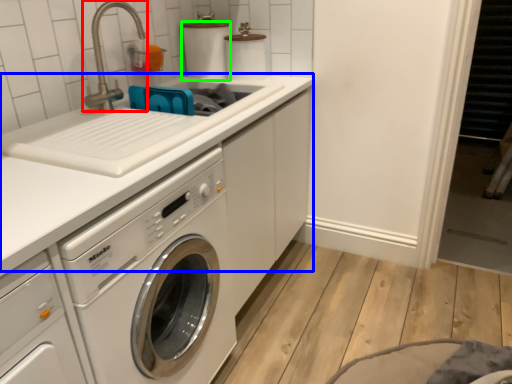
Question: Which is nearer to the faucet (highlighted by a red box)? counter top (highlighted by a blue box) or toilet paper (highlighted by a green box).

Choices:
 (A) counter top
 (B) toilet paper

Answer: (B)